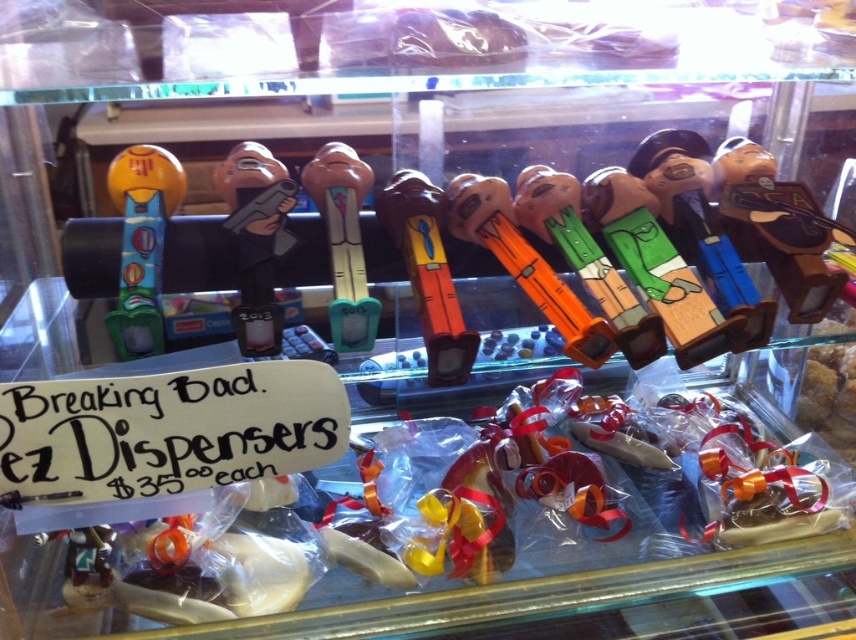
Between white paper sign at lower left and matte plastic dispenser at left, which one has less height?

Standing shorter between the two is white paper sign at lower left.

Is white paper sign at lower left bigger than matte plastic dispenser at left?

No, white paper sign at lower left is not bigger than matte plastic dispenser at left.

Between point (144, 417) and point (153, 268), which one is positioned behind?

Point (153, 268)

Image resolution: width=856 pixels, height=640 pixels. In order to click on white paper sign at lower left in this screenshot , I will do `click(167, 429)`.

The height and width of the screenshot is (640, 856). Describe the element at coordinates (141, 243) in the screenshot. I see `matte plastic dispenser at left` at that location.

Which is more to the left, matte plastic dispenser at left or orange plastic toy at center?

Positioned to the left is matte plastic dispenser at left.

Image resolution: width=856 pixels, height=640 pixels. Identify the location of matte plastic dispenser at left. (141, 243).

At what (x,y) coordinates should I click in order to perform the action: click on matte plastic dispenser at left. Please return your answer as a coordinate pair (x, y). Looking at the image, I should click on (141, 243).

Can you confirm if orange plastic gun at center is thinner than matte plastic toy at center?

No, orange plastic gun at center is not thinner than matte plastic toy at center.

Does point (545, 196) come farther from viewer compared to point (361, 321)?

Yes, it is behind point (361, 321).

Is point (535, 216) positioned before point (376, 305)?

No, (535, 216) is behind (376, 305).

This screenshot has width=856, height=640. Identify the location of orange plastic gun at center. (586, 259).